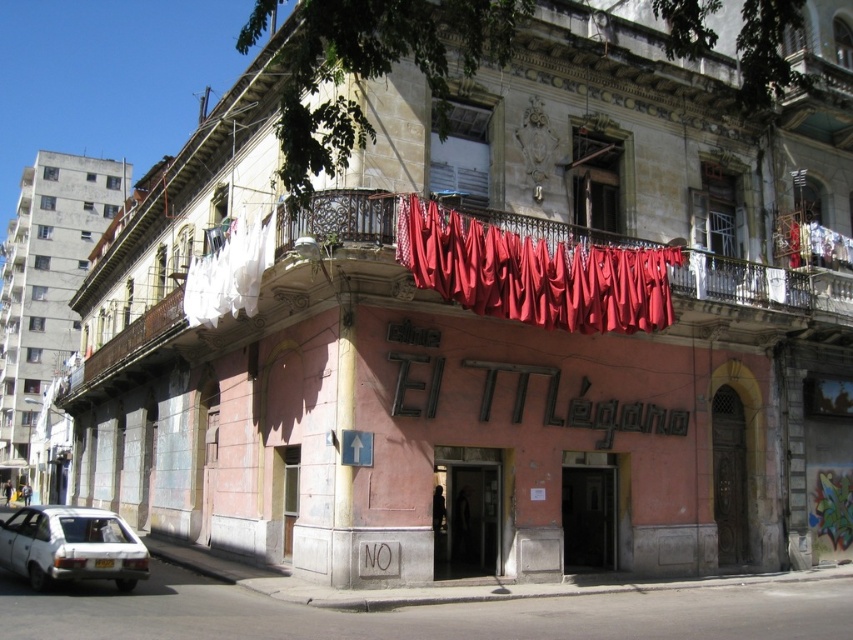
Measure the distance between red fabric at upper center and camera.

red fabric at upper center is 156.69 feet from camera.

Is point (473, 289) positioned in front of point (35, 548)?

No, (473, 289) is further to viewer.

Does point (469, 273) lie behind point (114, 560)?

Yes, it is behind point (114, 560).

In order to click on red fabric at upper center in this screenshot , I will do `click(534, 273)`.